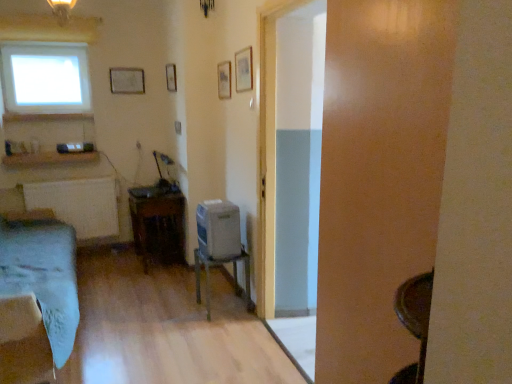
Where is `free point to the left of metallic gray table at center, which ranks as the second table in left-to-right order`? free point to the left of metallic gray table at center, which ranks as the second table in left-to-right order is located at coordinates (182, 308).